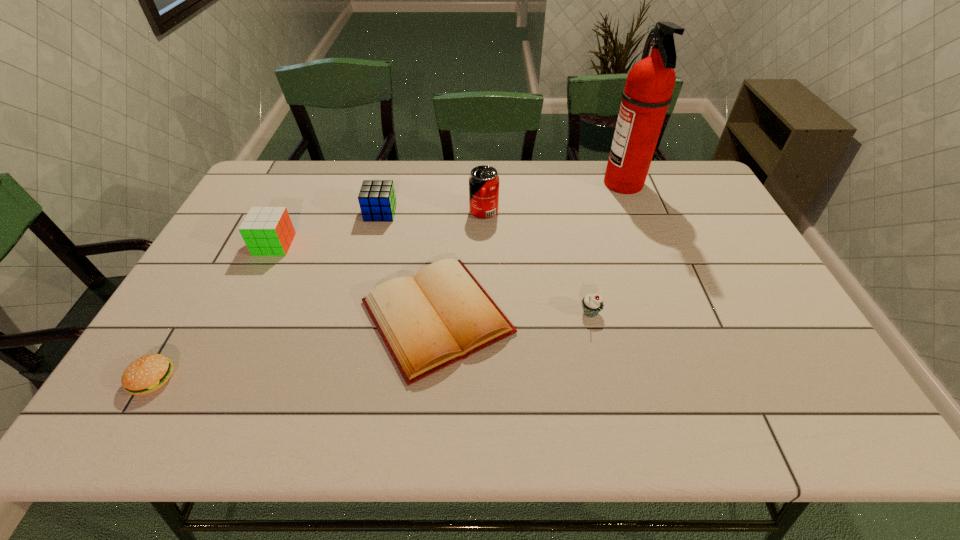
Locate an element on the screen. object present at the near edge is located at coordinates (148, 373).

I want to click on cube that is at the left edge, so click(267, 231).

At what (x,y) coordinates should I click in order to perform the action: click on patty located in the left edge section of the desktop. Please return your answer as a coordinate pair (x, y). Image resolution: width=960 pixels, height=540 pixels. Looking at the image, I should click on (148, 373).

The image size is (960, 540). What are the coordinates of `object positioned at the near left corner` in the screenshot? It's located at (148, 373).

In the image, there is a desktop. Where is `vacant space at the far edge`? The width and height of the screenshot is (960, 540). vacant space at the far edge is located at coordinates (603, 164).

At what (x,y) coordinates should I click in order to perform the action: click on vacant space at the near edge. Please return your answer as a coordinate pair (x, y). This screenshot has width=960, height=540. Looking at the image, I should click on (222, 402).

You are a GUI agent. You are given a task and a screenshot of the screen. Output one action in this format:
    pyautogui.click(x=<x>, y=<y>)
    Task: Click on the free space at the left edge of the desktop
    The image size is (960, 540).
    Given the screenshot: What is the action you would take?
    pyautogui.click(x=170, y=324)

The width and height of the screenshot is (960, 540). I want to click on vacant area at the right edge, so click(720, 291).

In the image, there is a desktop. Where is `vacant area at the far left corner`? The image size is (960, 540). vacant area at the far left corner is located at coordinates (296, 162).

In the image, there is a desktop. In order to click on vacant space at the far right corner in this screenshot , I will do `click(673, 170)`.